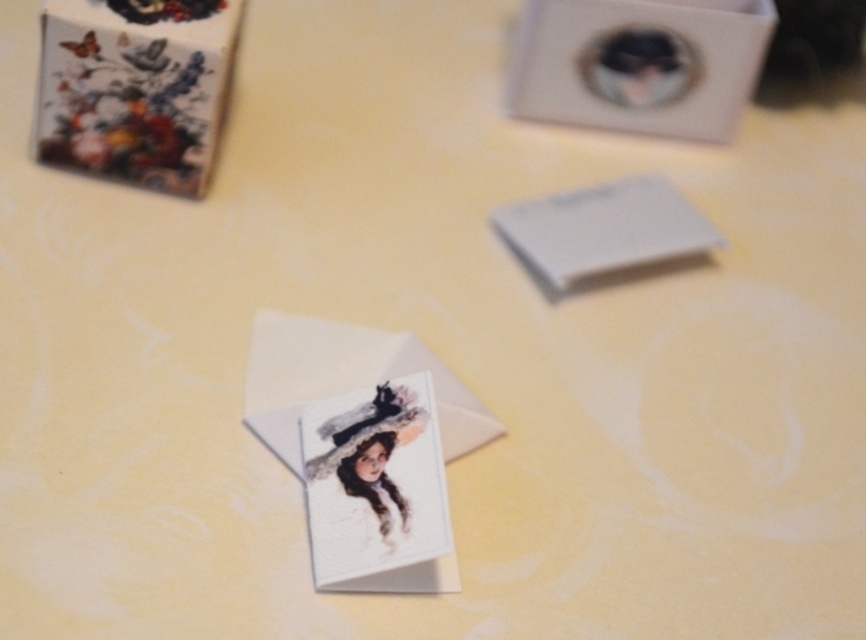
Identify the location of white cardboard box at upper center. (638, 64).

Between white cardboard box at upper center and white paper envelope at center, which one has more height?

white cardboard box at upper center is taller.

The height and width of the screenshot is (640, 866). In order to click on white cardboard box at upper center in this screenshot , I will do `click(638, 64)`.

Does matte floral box at upper left appear under watercolor paper card at center?

Actually, matte floral box at upper left is above watercolor paper card at center.

Which is in front, point (169, 72) or point (399, 397)?

Point (399, 397) is more forward.

The height and width of the screenshot is (640, 866). I want to click on matte floral box at upper left, so [134, 88].

Based on the photo, between white cardboard box at upper center and watercolor paper card at center, which one appears on the left side from the viewer's perspective?

watercolor paper card at center

Can you confirm if white cardboard box at upper center is taller than watercolor paper card at center?

Incorrect, white cardboard box at upper center's height is not larger of watercolor paper card at center's.

Does point (606, 51) come in front of point (322, 474)?

No, it is not.

At what (x,y) coordinates should I click in order to perform the action: click on white cardboard box at upper center. Please return your answer as a coordinate pair (x, y). This screenshot has width=866, height=640. Looking at the image, I should click on (638, 64).